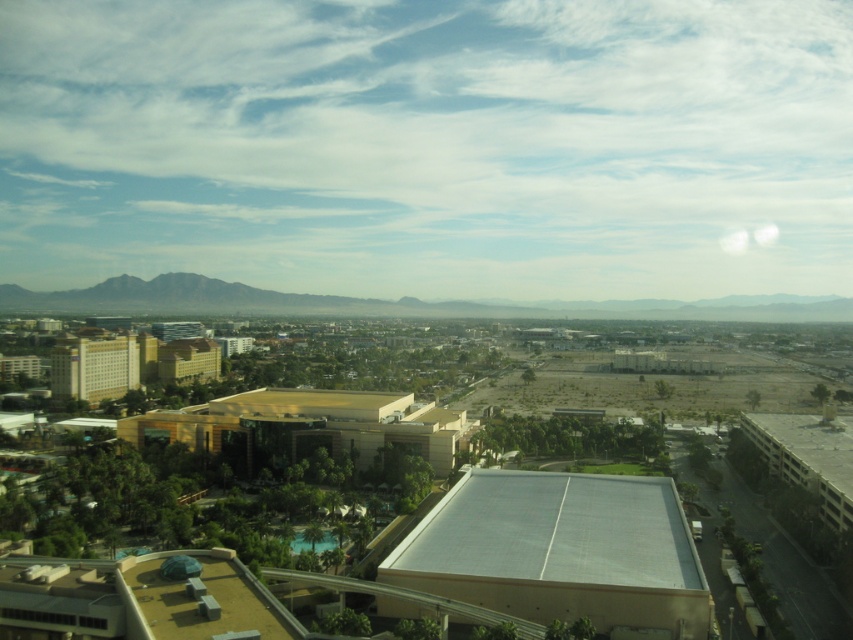
Question: Can you confirm if beige concrete hotel at left is positioned above beige concrete building at center?

Choices:
 (A) no
 (B) yes

Answer: (A)

Question: Which point appears farthest from the camera in this image?

Choices:
 (A) (465, 420)
 (B) (636, 515)

Answer: (A)

Question: Does white matte roof at center appear over gray concrete parking garage at lower right?

Choices:
 (A) yes
 (B) no

Answer: (B)

Question: Is golden textured building at center bigger than beige concrete hotel at left?

Choices:
 (A) yes
 (B) no

Answer: (B)

Question: Which of the following is the farthest from the observer?

Choices:
 (A) (199, 340)
 (B) (440, 563)
 (C) (312, 419)

Answer: (A)

Question: Which object is the closest to the golden textured building at center?

Choices:
 (A) white matte roof at center
 (B) gray concrete parking garage at lower right
 (C) beige concrete hotel at left

Answer: (A)